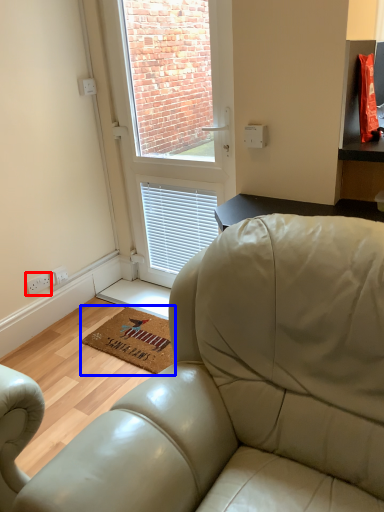
Question: Which object is closer to the camera taking this photo, electric outlet (highlighted by a red box) or mat (highlighted by a blue box)?

Choices:
 (A) electric outlet
 (B) mat

Answer: (B)